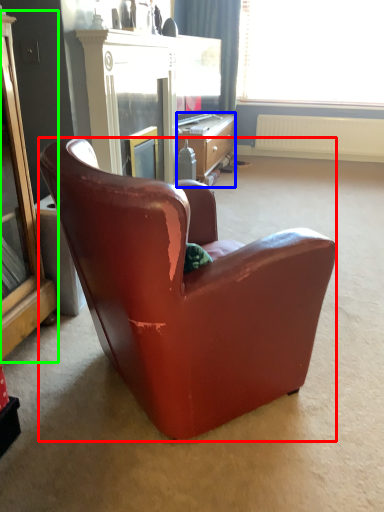
Question: Estimate the real-world distances between objects in this image. Which object is closer to chair (highlighted by a red box), desk (highlighted by a blue box) or cabinetry (highlighted by a green box)?

Choices:
 (A) desk
 (B) cabinetry

Answer: (B)